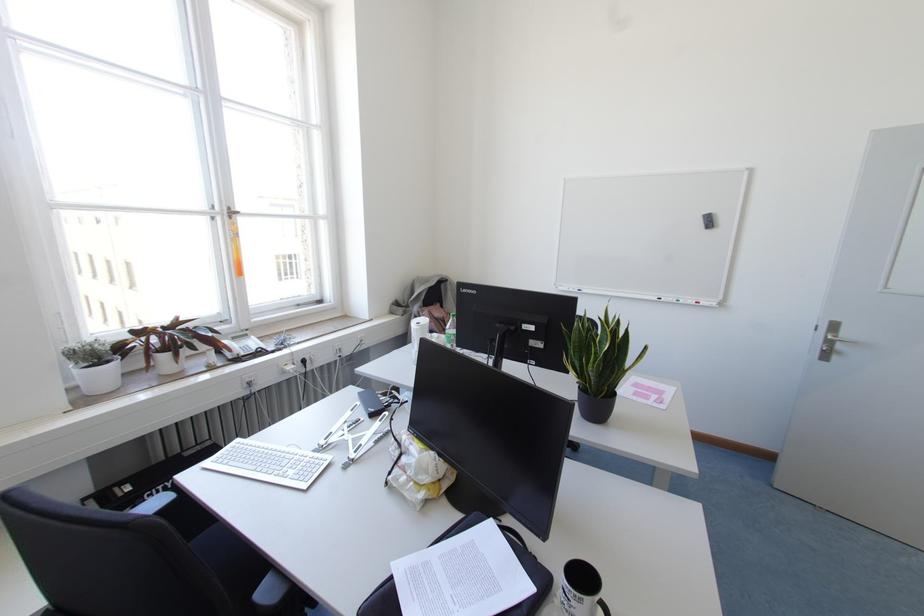
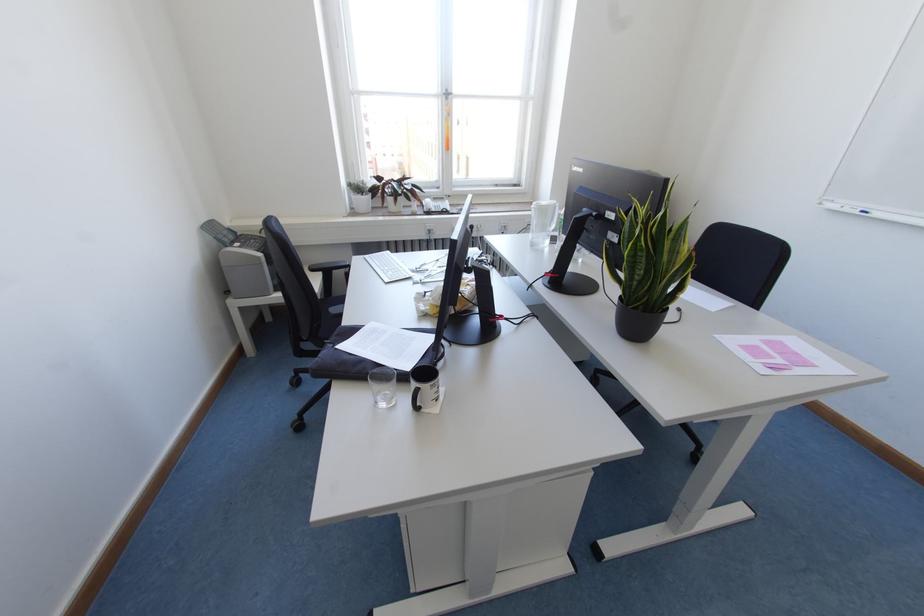
In the second image, find the point that corresponds to pixel 497 525 in the first image.

(433, 338)